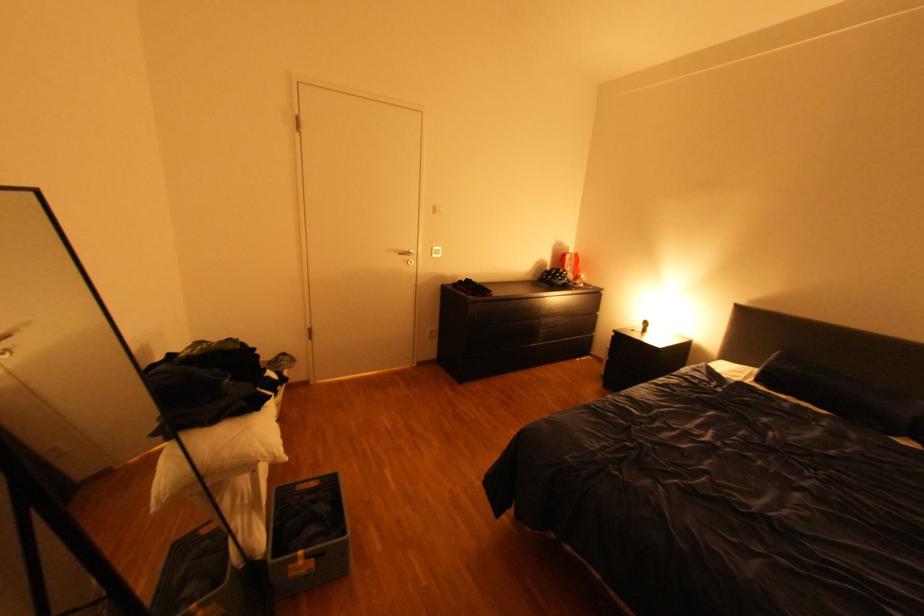
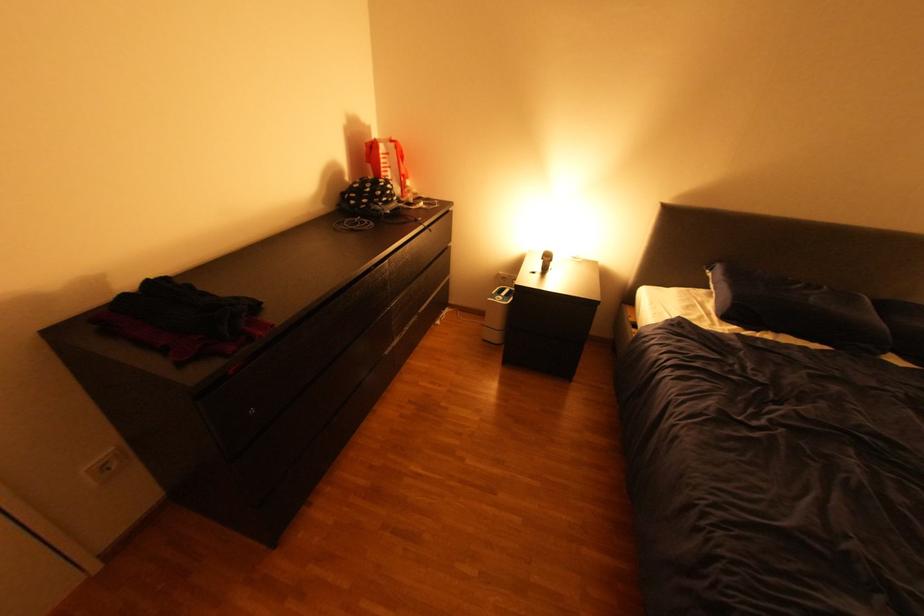
The point at (x=659, y=328) is marked in the first image. Where is the corresponding point in the second image?

(561, 262)